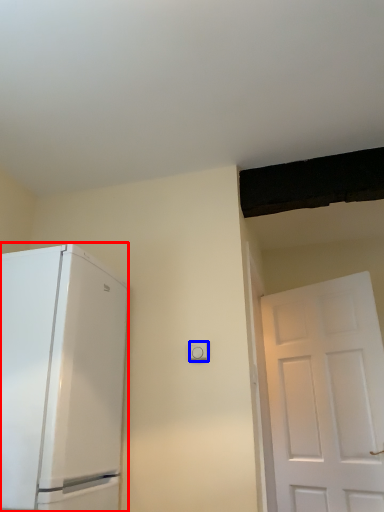
Question: Which object is further to the camera taking this photo, refrigerator (highlighted by a red box) or light switch (highlighted by a blue box)?

Choices:
 (A) refrigerator
 (B) light switch

Answer: (B)